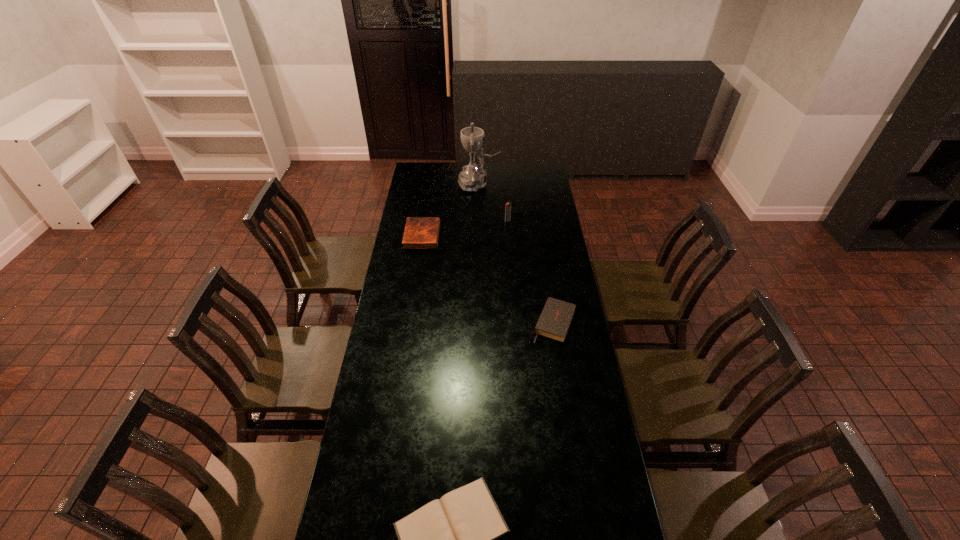
The height and width of the screenshot is (540, 960). I want to click on the farthest object, so click(x=473, y=177).

The image size is (960, 540). In order to click on award in this screenshot , I will do `click(473, 177)`.

You are a GUI agent. You are given a task and a screenshot of the screen. Output one action in this format:
    pyautogui.click(x=<x>, y=<y>)
    Task: Click on the fourth nearest object
    Image resolution: width=960 pixels, height=540 pixels.
    Given the screenshot: What is the action you would take?
    pyautogui.click(x=508, y=206)

Where is `the second object from right to left`? The height and width of the screenshot is (540, 960). the second object from right to left is located at coordinates (508, 206).

Find the location of a particular element. Image resolution: width=960 pixels, height=540 pixels. the rightmost Bible is located at coordinates (555, 319).

Identify the location of the second farthest Bible. (555, 319).

Find the location of `the farthest Bible`. the farthest Bible is located at coordinates [420, 232].

The image size is (960, 540). Identify the location of blank area located on the side with emblem of the tallest object. (511, 184).

Find the location of a particular element. This screenshot has width=960, height=540. vacant space located 0.080m on the right of the second tallest object is located at coordinates (525, 221).

Where is `blank space located 0.220m on the back of the rightmost object`? The height and width of the screenshot is (540, 960). blank space located 0.220m on the back of the rightmost object is located at coordinates [x=546, y=268].